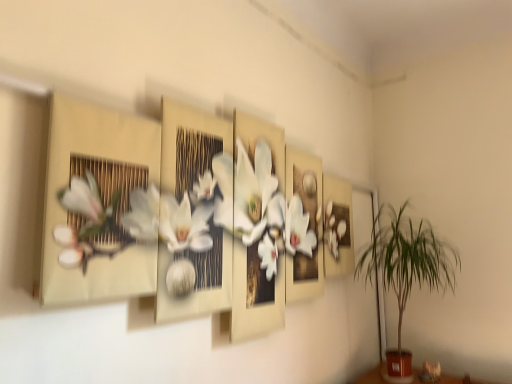
Question: Should I look upward or downward to see green leafy plant at right?

Choices:
 (A) down
 (B) up

Answer: (A)